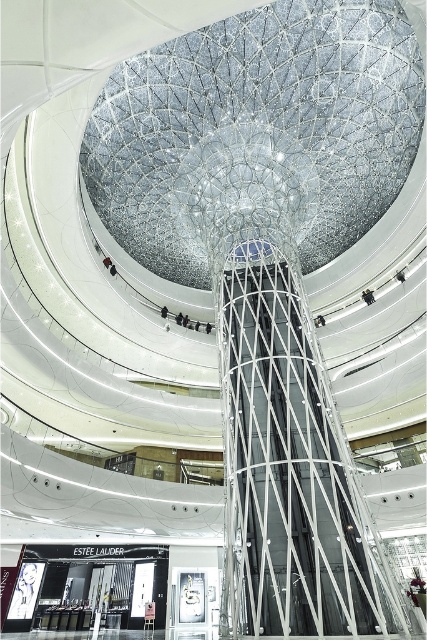
You are standing at the entrance of the mall and want to take the escalator to the upper floor. However, you notice a large transparent glass dome at center above the metallic wireframe escalator at center. Could the dome interfere with your ability to reach the upper floor via the escalator?

The transparent glass dome at center is positioned over the metallic wireframe escalator at center, so it does not block the path. You can safely use the escalator to reach the upper floor.

You are standing at the entrance of the mall and want to take the metallic wireframe escalator at center to the upper floor. The escalator is directly below the transparent glass dome at center. Do you think the dome will block your view of the upper floor while riding the escalator?

The transparent glass dome at center might be wider than metallic wireframe escalator at center, so it is possible that the dome does not block the view of the upper floor since its width could allow visibility around it.

You are standing at the entrance of the mall and want to take the metallic wireframe escalator at center to the upper floor. However, there is a transparent glass dome at center in your path. Can you walk straight ahead to reach the escalator without going around?

The transparent glass dome at center is further to the viewer than the metallic wireframe escalator at center, so the dome is closer to you. Therefore, you cannot walk straight ahead to reach the escalator without encountering the dome first. You will need to go around it.